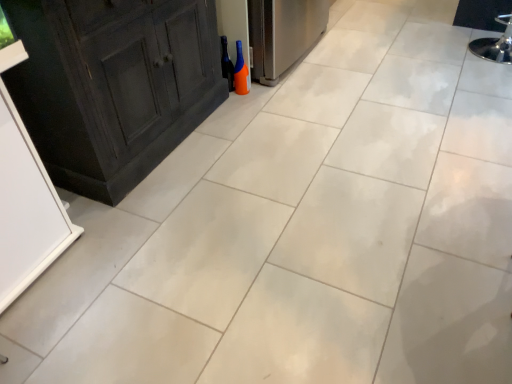
Question: Does orange matte bottle at center have a greater height compared to black glass wine bottle at center?

Choices:
 (A) no
 (B) yes

Answer: (A)

Question: Is orange matte bottle at center outside of black glass wine bottle at center?

Choices:
 (A) yes
 (B) no

Answer: (A)

Question: Does orange matte bottle at center turn towards black glass wine bottle at center?

Choices:
 (A) yes
 (B) no

Answer: (A)

Question: Is orange matte bottle at center at the right side of black glass wine bottle at center?

Choices:
 (A) no
 (B) yes

Answer: (B)

Question: From the image's perspective, would you say orange matte bottle at center is positioned over black glass wine bottle at center?

Choices:
 (A) no
 (B) yes

Answer: (A)

Question: Is orange matte bottle at center with black glass wine bottle at center?

Choices:
 (A) yes
 (B) no

Answer: (A)

Question: Can you confirm if black glass wine bottle at center is taller than orange matte bottle at center?

Choices:
 (A) no
 (B) yes

Answer: (B)

Question: Is orange matte bottle at center a part of black glass wine bottle at center?

Choices:
 (A) no
 (B) yes

Answer: (A)

Question: Considering the relative positions of black glass wine bottle at center and orange matte bottle at center in the image provided, is black glass wine bottle at center behind orange matte bottle at center?

Choices:
 (A) no
 (B) yes

Answer: (B)

Question: Are black glass wine bottle at center and orange matte bottle at center beside each other?

Choices:
 (A) no
 (B) yes

Answer: (B)

Question: Is black glass wine bottle at center at the left side of orange matte bottle at center?

Choices:
 (A) yes
 (B) no

Answer: (A)

Question: Is black glass wine bottle at center oriented away from orange matte bottle at center?

Choices:
 (A) yes
 (B) no

Answer: (A)

Question: Is point (245, 66) closer or farther from the camera than point (230, 74)?

Choices:
 (A) closer
 (B) farther

Answer: (A)